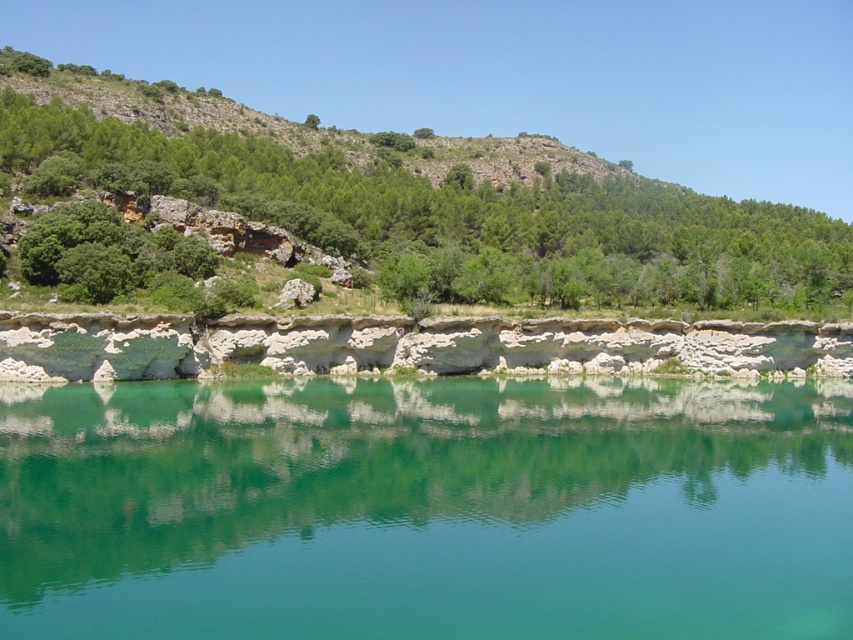
You are standing at the edge of the green smooth water at center and want to look at the green leafy hillside at upper left. Which direction should you turn your head to see the hillside?

You should turn your head to the upper left to see the green leafy hillside at upper left because it is located in that direction relative to the green smooth water at center.

You are a hiker standing at the edge of the green smooth water at center and want to take a photo of the green leafy hillside at upper left. Which direction should you face to capture the hillside in your shot?

You should face upward to capture the green leafy hillside at upper left in your photo since it is positioned above the green smooth water at center.

You are standing at the edge of the green smooth water at center and want to take a photo of the green leafy hillside at upper left. In which direction should you point your camera?

You should point your camera to the left because the green leafy hillside at upper left is located to the left of the green smooth water at center.